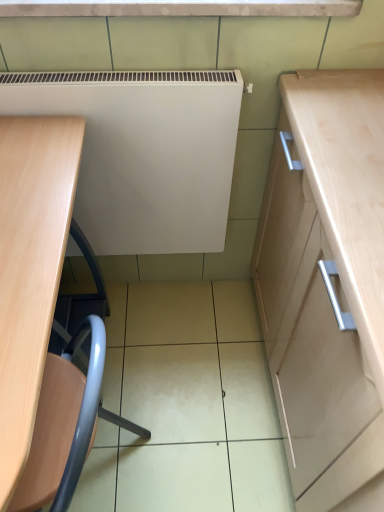
Question: Considering the relative sizes of white matte radiator at center and light wood desk at left in the image provided, is white matte radiator at center wider than light wood desk at left?

Choices:
 (A) yes
 (B) no

Answer: (B)

Question: Is white matte radiator at center aimed at light wood desk at left?

Choices:
 (A) yes
 (B) no

Answer: (A)

Question: Would you say white matte radiator at center is outside light wood desk at left?

Choices:
 (A) no
 (B) yes

Answer: (B)

Question: From a real-world perspective, is white matte radiator at center below light wood desk at left?

Choices:
 (A) no
 (B) yes

Answer: (A)

Question: Does white matte radiator at center have a greater height compared to light wood desk at left?

Choices:
 (A) yes
 (B) no

Answer: (B)

Question: Is white matte radiator at center at the right side of light wood desk at left?

Choices:
 (A) yes
 (B) no

Answer: (A)

Question: Could you tell me if metallic blue swivel chair at lower left is facing light wood desk at left?

Choices:
 (A) no
 (B) yes

Answer: (B)

Question: Is metallic blue swivel chair at lower left closer to the viewer compared to light wood desk at left?

Choices:
 (A) no
 (B) yes

Answer: (A)

Question: Is metallic blue swivel chair at lower left positioned with its back to light wood desk at left?

Choices:
 (A) yes
 (B) no

Answer: (A)

Question: Can you confirm if metallic blue swivel chair at lower left is bigger than light wood desk at left?

Choices:
 (A) no
 (B) yes

Answer: (A)

Question: From the image's perspective, would you say metallic blue swivel chair at lower left is shown under light wood desk at left?

Choices:
 (A) no
 (B) yes

Answer: (B)

Question: Does metallic blue swivel chair at lower left lie behind light wood desk at left?

Choices:
 (A) no
 (B) yes

Answer: (B)

Question: Does metallic blue swivel chair at lower left have a smaller size compared to white matte radiator at center?

Choices:
 (A) yes
 (B) no

Answer: (B)